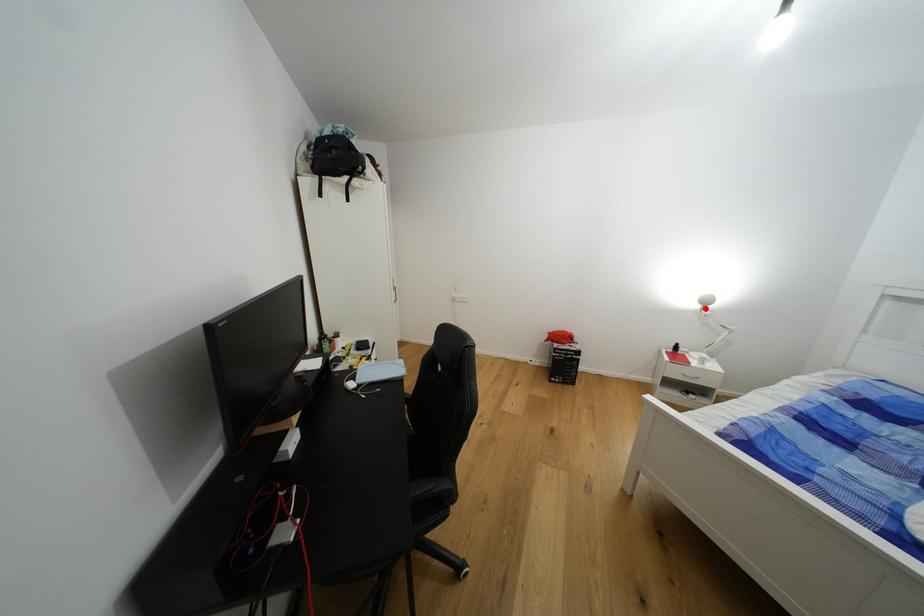
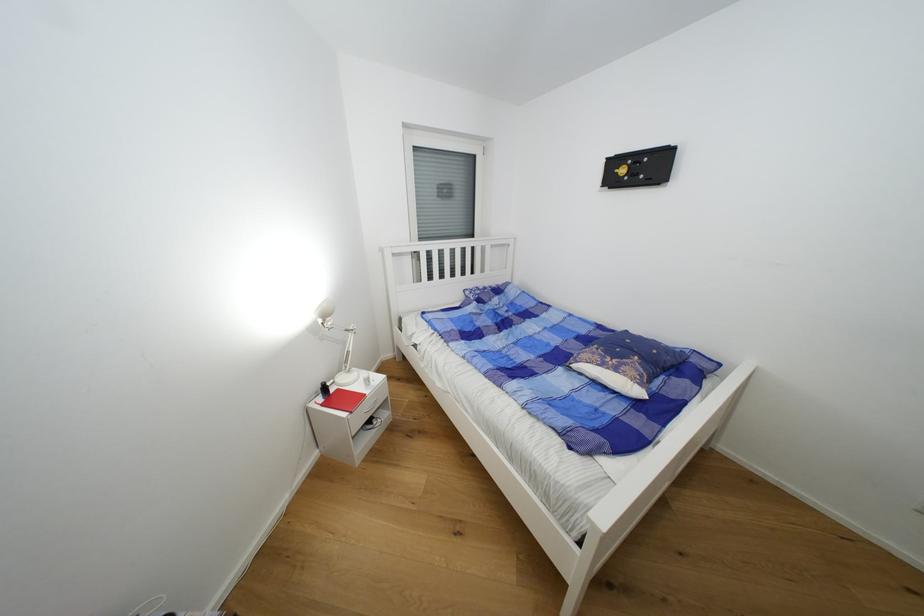
Question: I am providing you with two images of the same scene from different viewpoints. Given a red point in image1, look at the same physical point in image2. Is it:

Choices:
 (A) Closer to the viewpoint
 (B) Farther from the viewpoint

Answer: (A)